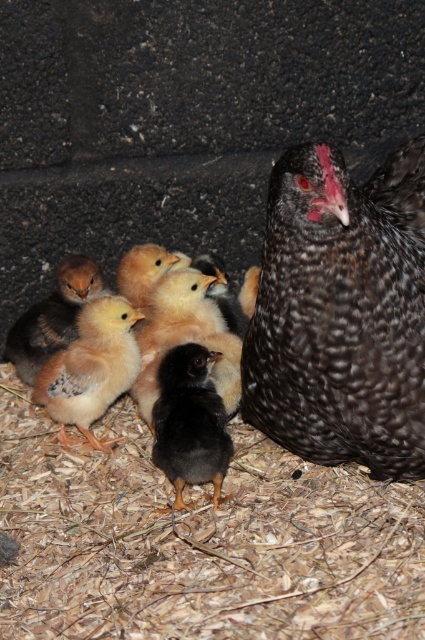
Question: Is light yellow downy chick at center to the left of black matte chick at center from the viewer's perspective?

Choices:
 (A) no
 (B) yes

Answer: (B)

Question: Does light yellow downy chick at center have a greater width compared to yellow downy chick at left?

Choices:
 (A) no
 (B) yes

Answer: (A)

Question: Which point is farther from the camera taking this photo?

Choices:
 (A) (314, 284)
 (B) (124, 316)
 (C) (65, 323)

Answer: (C)

Question: Which point is closer to the camera?

Choices:
 (A) (278, 208)
 (B) (101, 387)
 (C) (45, 308)
 (D) (173, 440)

Answer: (A)

Question: Considering the real-world distances, which object is closest to the yellow downy chick at left?

Choices:
 (A) black matte chick at center
 (B) speckled feathered hen at center
 (C) light yellow downy chick at center

Answer: (C)

Question: Does speckled feathered hen at center appear over black matte chick at center?

Choices:
 (A) no
 (B) yes

Answer: (B)